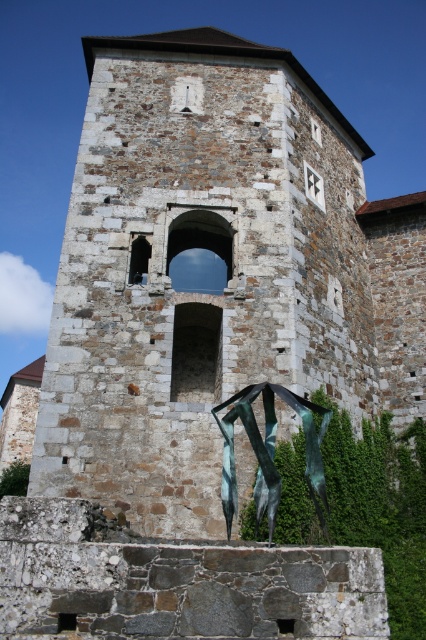
You are an architect assessing the structural integrity of the stone tower at center and the green patina metal sculpture at center. Which structure is taller?

The stone tower at center is taller than the green patina metal sculpture at center.

You are an architect visiting a historic site and see the stone tower at center and the green patina metal sculpture at center. Which one would you need to look up more to view the top?

The stone tower at center is bigger than the green patina metal sculpture at center, so you would need to look up more to view the top of the stone tower at center.